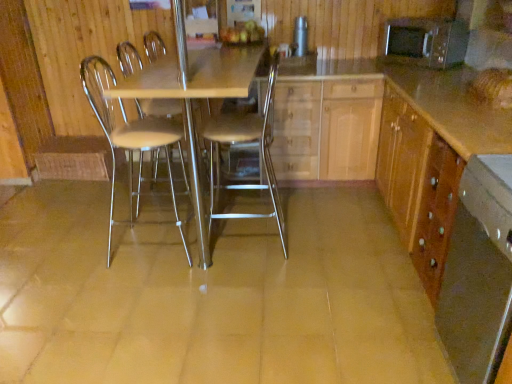
Where is `free space in front of metallic/transparent table at center`? Image resolution: width=512 pixels, height=384 pixels. free space in front of metallic/transparent table at center is located at coordinates (162, 329).